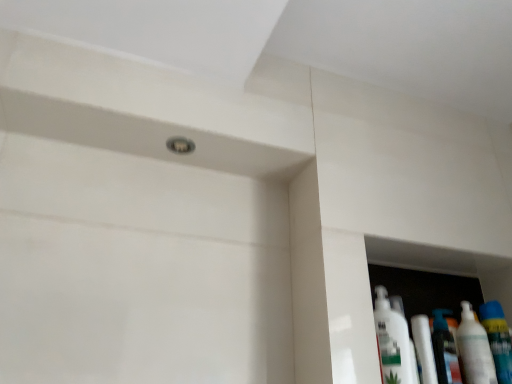
Question: Is white glossy bottle at right, which is the first mouthwash in left-to-right order, bigger or smaller than white glossy bottle at right, the 1th cleaning product when ordered from right to left?

Choices:
 (A) small
 (B) big

Answer: (A)

Question: In the image, is white glossy bottle at right, acting as the second mouthwash starting from the right, positioned in front of or behind white glossy bottle at right, the 2th cleaning product viewed from the left?

Choices:
 (A) front
 (B) behind

Answer: (B)

Question: Based on their relative distances, which object is nearer to the white glossy tube at lower right?

Choices:
 (A) white glossy bottle at lower right, which appears as the 1th cleaning product when viewed from the left
 (B) white glossy bottle at right, the 1th cleaning product when ordered from right to left
 (C) translucent plastic mouthwash at right, the second mouthwash positioned from the left
 (D) white glossy bottle at right, acting as the second mouthwash starting from the right

Answer: (D)

Question: Which object is positioned closest to the white glossy tube at lower right?

Choices:
 (A) white glossy bottle at lower right, which appears as the 1th cleaning product when viewed from the left
 (B) translucent plastic mouthwash at right, the second mouthwash positioned from the left
 (C) white glossy bottle at right, which is the first mouthwash in left-to-right order
 (D) white glossy bottle at right, the 1th cleaning product when ordered from right to left

Answer: (C)